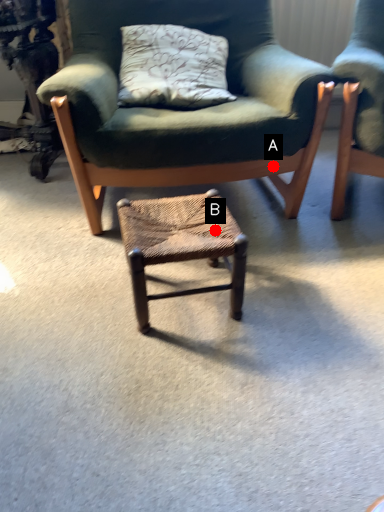
Question: Two points are circled on the image, labeled by A and B beside each circle. Which point is further to the camera?

Choices:
 (A) A is further
 (B) B is further

Answer: (A)